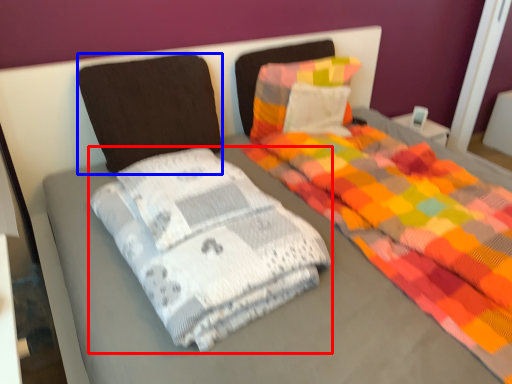
Question: Which object appears closest to the camera in this image, material (highlighted by a red box) or pillow (highlighted by a blue box)?

Choices:
 (A) material
 (B) pillow

Answer: (A)